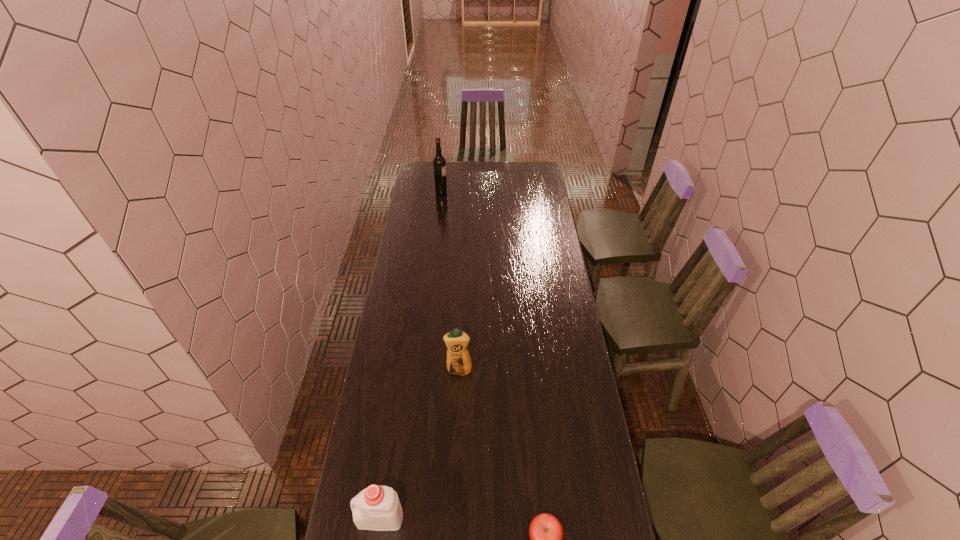
The width and height of the screenshot is (960, 540). Identify the location of wine bottle. (439, 163).

Locate an element on the screen. the farthest object is located at coordinates point(439,163).

Locate an element on the screen. The height and width of the screenshot is (540, 960). the right detergent is located at coordinates (459, 362).

This screenshot has width=960, height=540. What are the coordinates of `the second object from right to left` in the screenshot? It's located at (459, 362).

At what (x,y) coordinates should I click in order to perform the action: click on the shorter detergent. Please return your answer as a coordinate pair (x, y). The image size is (960, 540). Looking at the image, I should click on (378, 508).

Where is `the third tallest object`? This screenshot has width=960, height=540. the third tallest object is located at coordinates (378, 508).

Identify the location of vacant point located 0.200m on the front and back of the wine bottle. The width and height of the screenshot is (960, 540). (481, 192).

The image size is (960, 540). What are the coordinates of `vacant area situated 0.340m on the label of the farther detergent` in the screenshot? It's located at (455, 462).

Identify the location of wine bottle that is at the left edge. This screenshot has height=540, width=960. (439, 163).

Locate an element on the screen. The width and height of the screenshot is (960, 540). detergent located in the left edge section of the desktop is located at coordinates (378, 508).